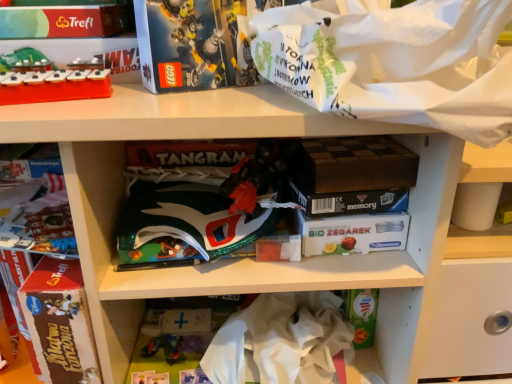
This screenshot has height=384, width=512. What do you see at coordinates (396, 64) in the screenshot?
I see `white paper bag at upper right` at bounding box center [396, 64].

At what (x,y) coordinates should I click in order to perform the action: click on shiny green plastic book at center. Please return your answer as a coordinate pair (x, y). Image resolution: width=512 pixels, height=384 pixels. Looking at the image, I should click on (258, 197).

At what (x,y) coordinates should I click in order to perform the action: click on brown cardboard book at left. Please return your answer as a coordinate pair (x, y). The height and width of the screenshot is (384, 512). Looking at the image, I should click on (60, 322).

Is brown cardboard book at left inside or outside of white crumpled paper at center?

brown cardboard book at left is spatially situated outside white crumpled paper at center.

Locate an element on the screen. Image resolution: width=512 pixels, height=384 pixels. clothing on the right side of brown cardboard book at left is located at coordinates (281, 339).

Relative to white crumpled paper at center, is brown cardboard book at left in front or behind?

In the image, brown cardboard book at left appears in front of white crumpled paper at center.

From the image's perspective, which one is positioned lower, brown cardboard book at left or white crumpled paper at center?

white crumpled paper at center, from the image's perspective.

From a real-world perspective, between white crumpled paper at center and shiny green plastic book at center, who is vertically higher?

shiny green plastic book at center.

What's the angular difference between white crumpled paper at center and shiny green plastic book at center's facing directions?

The angular difference between white crumpled paper at center and shiny green plastic book at center is 0.493 degrees.

Is white crumpled paper at center at the left side of shiny green plastic book at center?

In fact, white crumpled paper at center is to the right of shiny green plastic book at center.

Would you say white crumpled paper at center is outside shiny green plastic book at center?

white crumpled paper at center is positioned outside shiny green plastic book at center.

Where is `toy below the white paper bag at upper right (from a real-world perspective)`? toy below the white paper bag at upper right (from a real-world perspective) is located at coordinates (54, 84).

Does matte plastic xylophone at upper left have a lesser width compared to white paper bag at upper right?

Yes, matte plastic xylophone at upper left is thinner than white paper bag at upper right.

Is matte plastic xylophone at upper left aimed at white paper bag at upper right?

No, matte plastic xylophone at upper left is not turned towards white paper bag at upper right.

Between point (42, 80) and point (383, 57), which one is positioned in front?

The point (383, 57) is closer.

Can you tell me how much brown cardboard book at left and matte plastic xylophone at upper left differ in facing direction?

19 degrees separate the facing orientations of brown cardboard book at left and matte plastic xylophone at upper left.

In the scene shown: Considering the sizes of objects brown cardboard book at left and matte plastic xylophone at upper left in the image provided, who is taller, brown cardboard book at left or matte plastic xylophone at upper left?

brown cardboard book at left is taller.

Which of these two, brown cardboard book at left or matte plastic xylophone at upper left, is smaller?

brown cardboard book at left.

In terms of width, does brown cardboard book at left look wider or thinner when compared to matte plastic xylophone at upper left?

Clearly, brown cardboard book at left has less width compared to matte plastic xylophone at upper left.

Which is closer to the camera, (487, 28) or (75, 78)?

Point (487, 28) is positioned closer to the camera compared to point (75, 78).

In terms of height, does white paper bag at upper right look taller or shorter compared to matte plastic xylophone at upper left?

In the image, white paper bag at upper right appears to be taller than matte plastic xylophone at upper left.

This screenshot has height=384, width=512. Identify the location of material located on the right of matte plastic xylophone at upper left. (396, 64).

Is white paper bag at upper right inside or outside of matte plastic xylophone at upper left?

white paper bag at upper right cannot be found inside matte plastic xylophone at upper left.

From a real-world perspective, is shiny green plastic book at center beneath brown cardboard book at left?

No, from a real-world perspective, shiny green plastic book at center is not beneath brown cardboard book at left.

Could you tell me if shiny green plastic book at center is facing brown cardboard book at left?

No.

Is the position of shiny green plastic book at center less distant than that of brown cardboard book at left?

That is True.

Which of these two, shiny green plastic book at center or brown cardboard book at left, is smaller?

brown cardboard book at left.

How many degrees apart are the facing directions of white crumpled paper at center and matte plastic xylophone at upper left?

The angular difference between white crumpled paper at center and matte plastic xylophone at upper left is 10.3 degrees.

Is the position of white crumpled paper at center less distant than that of matte plastic xylophone at upper left?

No, white crumpled paper at center is behind matte plastic xylophone at upper left.

At what (x,y) coordinates should I click in order to perform the action: click on clothing below the matte plastic xylophone at upper left (from a real-world perspective). Please return your answer as a coordinate pair (x, y). This screenshot has width=512, height=384. Looking at the image, I should click on pos(281,339).

Is matte plastic xylophone at upper left at the back of white crumpled paper at center?

No.

The width and height of the screenshot is (512, 384). In the image, there is a brown cardboard book at left. What are the coordinates of `clothing below it (from a real-world perspective)` in the screenshot? It's located at (281, 339).

Identify the location of book in front of the white crumpled paper at center. (258, 197).

Based on their spatial positions, is white paper bag at upper right or shiny green plastic book at center closer to white crumpled paper at center?

shiny green plastic book at center is positioned closer to the anchor white crumpled paper at center.

Looking at the image, which one is located closer to white paper bag at upper right, matte plastic xylophone at upper left or shiny green plastic book at center?

The object closer to white paper bag at upper right is shiny green plastic book at center.

From the image, which object appears to be farther from brown cardboard book at left, white crumpled paper at center or white paper bag at upper right?

The object further to brown cardboard book at left is white paper bag at upper right.

Looking at the image, which one is located further to white paper bag at upper right, white crumpled paper at center or matte plastic xylophone at upper left?

Based on the image, white crumpled paper at center appears to be further to white paper bag at upper right.

From the image, which object appears to be farther from shiny green plastic book at center, white crumpled paper at center or brown cardboard book at left?

brown cardboard book at left is further to shiny green plastic book at center.

Based on their spatial positions, is shiny green plastic book at center or white paper bag at upper right further from matte plastic xylophone at upper left?

white paper bag at upper right lies further to matte plastic xylophone at upper left than the other object.

Which object lies further to the anchor point white paper bag at upper right, white crumpled paper at center or shiny green plastic book at center?

white crumpled paper at center is further to white paper bag at upper right.

Looking at the image, which one is located closer to brown cardboard book at left, white crumpled paper at center or shiny green plastic book at center?

The object closer to brown cardboard book at left is shiny green plastic book at center.

I want to click on book between matte plastic xylophone at upper left and white paper bag at upper right from left to right, so click(x=258, y=197).

Image resolution: width=512 pixels, height=384 pixels. I want to click on clothing between brown cardboard book at left and white paper bag at upper right, so click(281, 339).

Locate an element on the screen. The width and height of the screenshot is (512, 384). book between brown cardboard book at left and white paper bag at upper right from left to right is located at coordinates (258, 197).

At what (x,y) coordinates should I click in order to perform the action: click on book that lies between matte plastic xylophone at upper left and brown cardboard book at left from top to bottom. Please return your answer as a coordinate pair (x, y). Looking at the image, I should click on (258, 197).